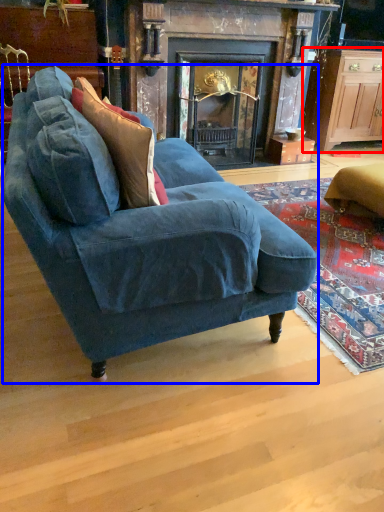
Question: Among these objects, which one is nearest to the camera, cabinetry (highlighted by a red box) or studio couch (highlighted by a blue box)?

Choices:
 (A) cabinetry
 (B) studio couch

Answer: (B)